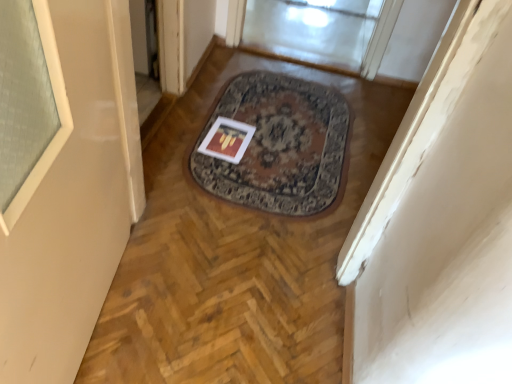
Where is `free location above matte paper postcard at center (from a real-world perspective)`? free location above matte paper postcard at center (from a real-world perspective) is located at coordinates [x=229, y=139].